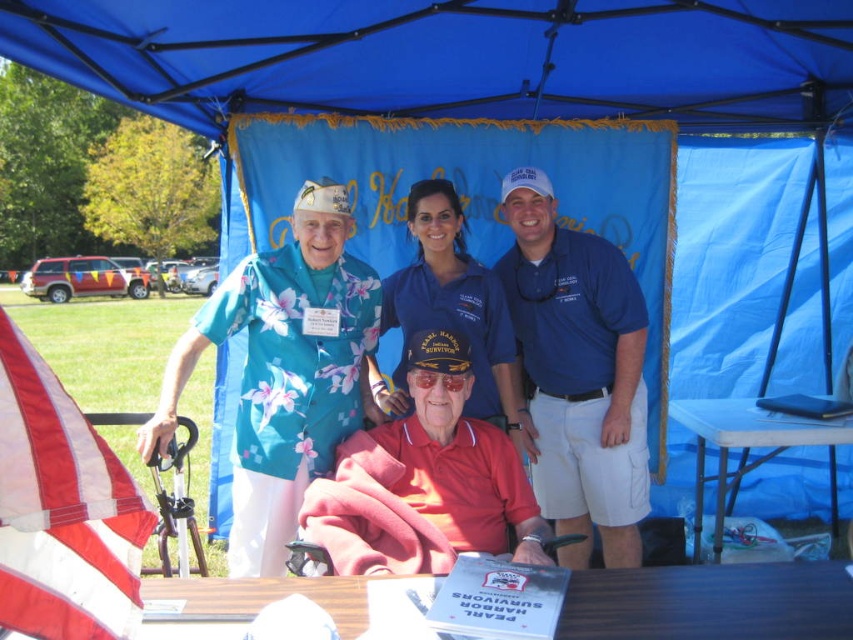
Is blue fabric canopy at upper center to the right of blue plastic table at lower right from the viewer's perspective?

No, blue fabric canopy at upper center is not to the right of blue plastic table at lower right.

Does blue fabric canopy at upper center have a smaller size compared to blue plastic table at lower right?

Incorrect, blue fabric canopy at upper center is not smaller in size than blue plastic table at lower right.

Is point (651, 12) in front of point (704, 426)?

Yes, it is.

Where is `blue fabric canopy at upper center`? This screenshot has width=853, height=640. blue fabric canopy at upper center is located at coordinates (450, 56).

Can you confirm if red fabric flag at lower left is positioned above wooden table at lower center?

Yes.

Can you confirm if red fabric flag at lower left is shorter than wooden table at lower center?

No.

I want to click on red fabric flag at lower left, so click(62, 509).

Consider the image. Can you confirm if teal floral shirt at left is thinner than red fabric flag at lower left?

Incorrect, teal floral shirt at left's width is not less than red fabric flag at lower left's.

Based on the photo, does teal floral shirt at left have a larger size compared to red fabric flag at lower left?

Yes.

Identify the location of teal floral shirt at left. (283, 371).

Find the location of `teal floral shirt at left`. teal floral shirt at left is located at coordinates (283, 371).